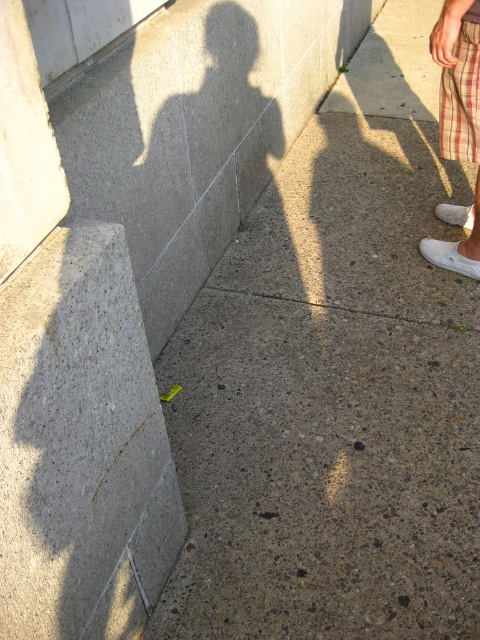
You are a delivery robot with a 12 inch wide package. You need to place it between the gray concrete pavement at lower left and the white fabric shoe at lower right. Is there enough space?

The distance between the gray concrete pavement at lower left and the white fabric shoe at lower right is 20.64 inches. Since the package is 12 inches wide, there is enough space to place it between them.